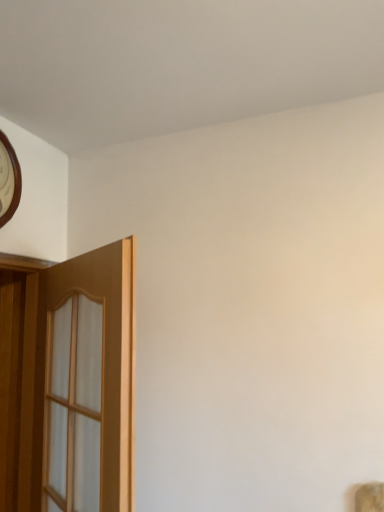
Locate an element on the screen. This screenshot has width=384, height=512. wooden door at left is located at coordinates (101, 368).

The width and height of the screenshot is (384, 512). What do you see at coordinates (101, 368) in the screenshot?
I see `wooden door at left` at bounding box center [101, 368].

Where is `wooden clock at upper left`? This screenshot has width=384, height=512. wooden clock at upper left is located at coordinates (9, 180).

What do you see at coordinates (9, 180) in the screenshot?
I see `wooden clock at upper left` at bounding box center [9, 180].

This screenshot has height=512, width=384. What are the coordinates of `wooden door at left` in the screenshot? It's located at [101, 368].

Based on the photo, is wooden door at left to the left or to the right of wooden clock at upper left in the image?

Based on their positions, wooden door at left is located to the right of wooden clock at upper left.

Considering the relative positions of wooden door at left and wooden clock at upper left in the image provided, is wooden door at left in front of wooden clock at upper left?

Yes, wooden door at left is in front of wooden clock at upper left.

Is point (122, 360) closer or farther from the camera than point (20, 174)?

Clearly, point (122, 360) is closer to the camera than point (20, 174).

From the image's perspective, between wooden door at left and wooden clock at upper left, who is located below?

wooden door at left, from the image's perspective.

From a real-world perspective, who is located lower, wooden door at left or wooden clock at upper left?

In real-world perspective, wooden door at left is lower.

Between wooden door at left and wooden clock at upper left, which one has larger width?

wooden door at left is wider.

Who is taller, wooden door at left or wooden clock at upper left?

wooden door at left is taller.

Does wooden door at left have a smaller size compared to wooden clock at upper left?

Actually, wooden door at left might be larger than wooden clock at upper left.

Consider the image. Can wooden clock at upper left be found inside wooden door at left?

No, wooden door at left does not contain wooden clock at upper left.

Can you see wooden door at left touching wooden clock at upper left?

No, wooden door at left is not next to wooden clock at upper left.

Is wooden door at left oriented away from wooden clock at upper left?

No, wooden door at left's orientation is not away from wooden clock at upper left.

What's the angular difference between wooden door at left and wooden clock at upper left's facing directions?

wooden door at left and wooden clock at upper left are facing 127 degrees away from each other.

Find the location of a particular element. The height and width of the screenshot is (512, 384). door in front of the wooden clock at upper left is located at coordinates (101, 368).

Visually, is wooden clock at upper left positioned to the left or to the right of wooden door at left?

From the image, it's evident that wooden clock at upper left is to the left of wooden door at left.

In the image, is wooden clock at upper left positioned in front of or behind wooden door at left?

Visually, wooden clock at upper left is located behind wooden door at left.

Considering the points (3, 179) and (106, 278), which point is behind, point (3, 179) or point (106, 278)?

The point (3, 179) is behind.

From the image's perspective, is wooden clock at upper left beneath wooden door at left?

No, from the image's perspective, wooden clock at upper left is not beneath wooden door at left.

From a real-world perspective, who is located higher, wooden clock at upper left or wooden door at left?

wooden clock at upper left.

Is wooden clock at upper left thinner than wooden door at left?

Yes.

Considering the sizes of wooden clock at upper left and wooden door at left in the image, is wooden clock at upper left taller or shorter than wooden door at left?

In the image, wooden clock at upper left appears to be shorter than wooden door at left.

Considering the sizes of objects wooden clock at upper left and wooden door at left in the image provided, who is smaller, wooden clock at upper left or wooden door at left?

wooden clock at upper left is smaller.

Is wooden clock at upper left not inside wooden door at left?

Yes.

Are wooden clock at upper left and wooden door at left far apart?

No, wooden clock at upper left is in close proximity to wooden door at left.

Could you tell me if wooden clock at upper left is turned towards wooden door at left?

No, wooden clock at upper left is not oriented towards wooden door at left.

How many degrees apart are the facing directions of wooden clock at upper left and wooden door at left?

The facing directions of wooden clock at upper left and wooden door at left are 127 degrees apart.

You are a GUI agent. You are given a task and a screenshot of the screen. Output one action in this format:
    pyautogui.click(x=<x>, y=<y>)
    Task: Click on the clock above the wooden door at left (from the image's perspective)
    Image resolution: width=384 pixels, height=512 pixels.
    Given the screenshot: What is the action you would take?
    point(9,180)

At what (x,y) coordinates should I click in order to perform the action: click on clock above the wooden door at left (from the image's perspective). Please return your answer as a coordinate pair (x, y). The image size is (384, 512). Looking at the image, I should click on (9, 180).

This screenshot has height=512, width=384. Find the location of `door that appears on the right of wooden clock at upper left`. door that appears on the right of wooden clock at upper left is located at coordinates (101, 368).